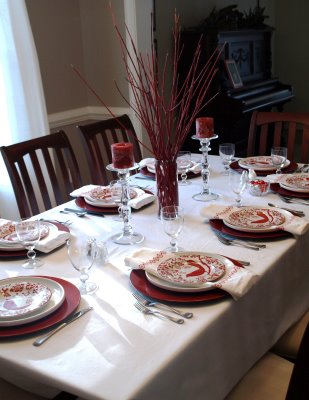
At what (x,y) coordinates should I click in order to perform the action: click on chairs. Please return your answer as a coordinate pair (x, y). The height and width of the screenshot is (400, 309). Looking at the image, I should click on (43, 192), (114, 122), (265, 134), (304, 337), (280, 362).